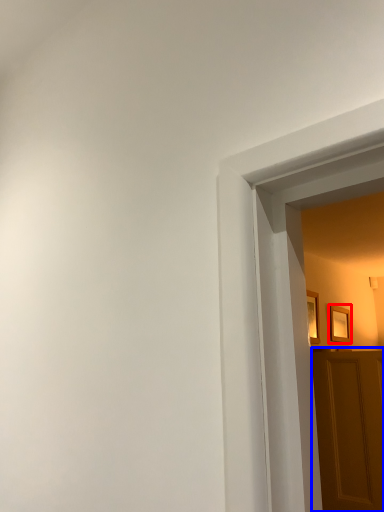
Question: Which point is closer to the camera, picture frame (highlighted by a red box) or door (highlighted by a blue box)?

Choices:
 (A) picture frame
 (B) door

Answer: (B)